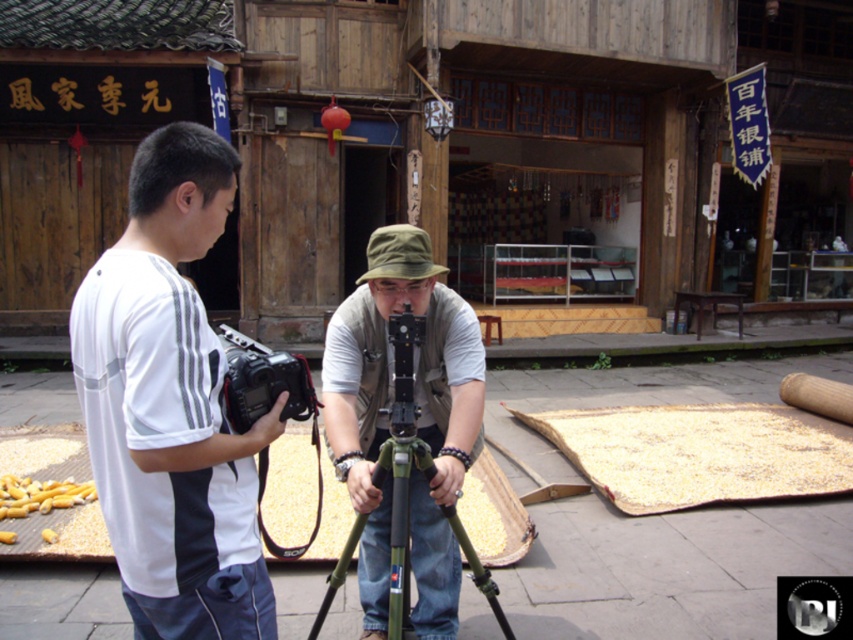
Question: Is khaki fabric hat at center to the left of black plastic camera at center from the viewer's perspective?

Choices:
 (A) no
 (B) yes

Answer: (A)

Question: Which point appears closest to the camera in this image?

Choices:
 (A) (460, 449)
 (B) (405, 564)
 (C) (200, 346)

Answer: (C)

Question: Does white fabric camera at left appear under khaki fabric hat at center?

Choices:
 (A) no
 (B) yes

Answer: (A)

Question: Which of the following is the closest to the observer?

Choices:
 (A) khaki fabric hat at center
 (B) black plastic camera at center

Answer: (B)

Question: Is green matte tripod at center smaller than black plastic camera at center?

Choices:
 (A) yes
 (B) no

Answer: (B)

Question: Estimate the real-world distances between objects in this image. Which object is closer to the green matte tripod at center?

Choices:
 (A) black plastic camera at center
 (B) khaki fabric hat at center

Answer: (B)